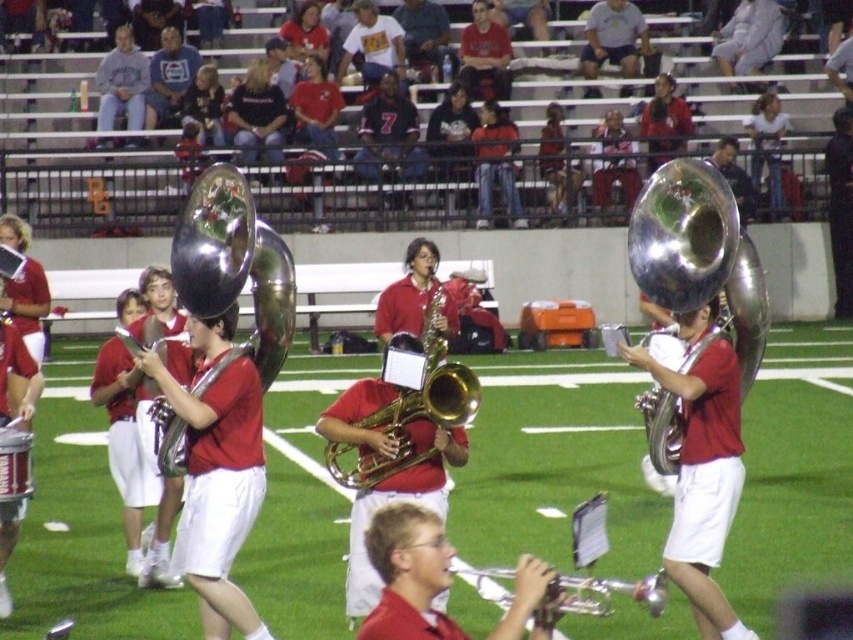
Which is in front, point (228, 228) or point (701, 400)?

Positioned in front is point (701, 400).

Does shiny brass trumpet at center appear on the right side of matte brass tuba at center?

No, shiny brass trumpet at center is not to the right of matte brass tuba at center.

You are a GUI agent. You are given a task and a screenshot of the screen. Output one action in this format:
    pyautogui.click(x=<x>, y=<y>)
    Task: Click on the shiny brass trumpet at center
    This screenshot has width=853, height=640.
    Given the screenshot: What is the action you would take?
    pyautogui.click(x=233, y=269)

Where is `shiny brass trumpet at center`? The width and height of the screenshot is (853, 640). shiny brass trumpet at center is located at coordinates click(x=233, y=269).

Based on the photo, is the position of shiny silver trumpet at center more distant than that of silver metallic trumpet at lower center?

That is True.

Is shiny silver trumpet at center wider than silver metallic trumpet at lower center?

Indeed, shiny silver trumpet at center has a greater width compared to silver metallic trumpet at lower center.

Measure the distance between point (660, 282) and camera.

Point (660, 282) is 7.45 meters away from camera.

I want to click on shiny silver trumpet at center, so click(699, 257).

Who is more forward, (x=709, y=362) or (x=663, y=589)?

Positioned in front is point (x=663, y=589).

You are a GUI agent. You are given a task and a screenshot of the screen. Output one action in this format:
    pyautogui.click(x=<x>, y=<y>)
    Task: Click on the matte brass tuba at center
    
    Given the screenshot: What is the action you would take?
    pyautogui.click(x=703, y=480)